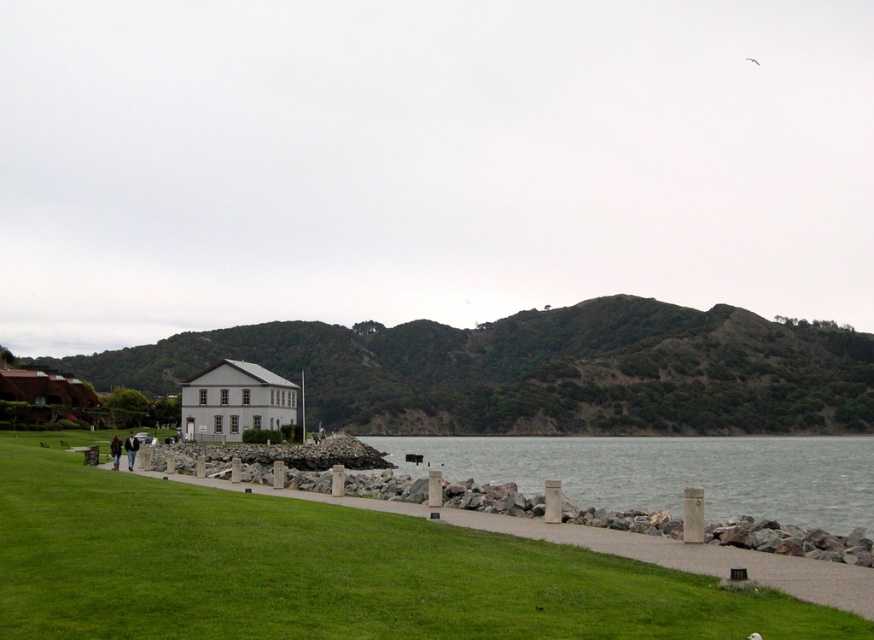
Question: Is green grass at lower left bigger than gray stone water at center?

Choices:
 (A) no
 (B) yes

Answer: (A)

Question: Which point is farther from the camera taking this photo?

Choices:
 (A) (380, 566)
 (B) (674, 353)
 (C) (588, 436)

Answer: (B)

Question: Estimate the real-world distances between objects in this image. Which object is closer to the green leafy hill at center?

Choices:
 (A) green grass at lower left
 (B) gray stone water at center

Answer: (B)

Question: Which point is farther to the camera?

Choices:
 (A) (650, 364)
 (B) (184, 508)

Answer: (A)

Question: Considering the relative positions of green grass at lower left and gray stone water at center in the image provided, where is green grass at lower left located with respect to gray stone water at center?

Choices:
 (A) right
 (B) left

Answer: (B)

Question: Can you confirm if green leafy hill at center is thinner than gray stone water at center?

Choices:
 (A) no
 (B) yes

Answer: (A)